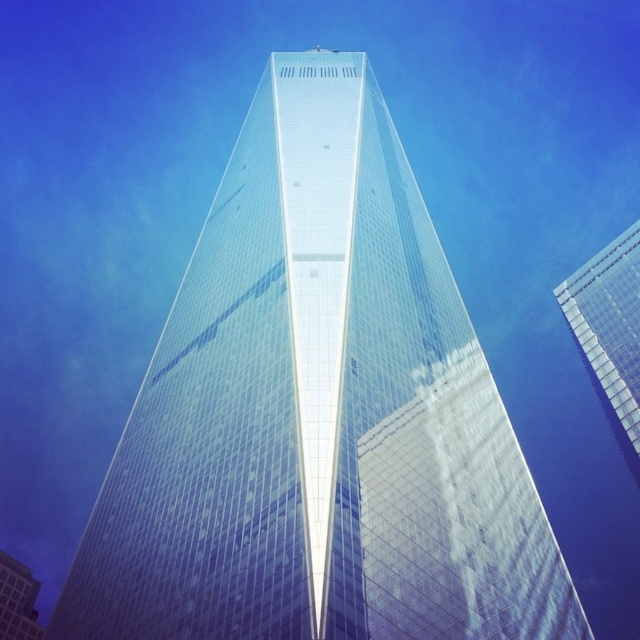
Does point (634, 230) lie behind point (13, 609)?

Yes, it is.

Which of these two, transparent glass skyscraper at right or transparent glass skyscraper at center, stands shorter?

With less height is transparent glass skyscraper at center.

Does point (620, 308) lie behind point (20, 570)?

No, it is not.

Where is `transparent glass skyscraper at right`? This screenshot has height=640, width=640. transparent glass skyscraper at right is located at coordinates coord(609,333).